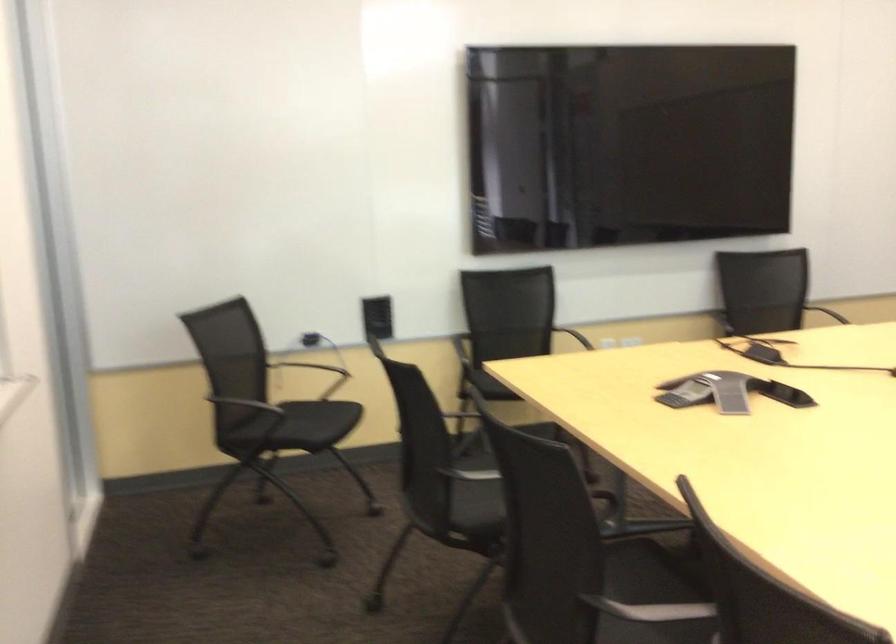
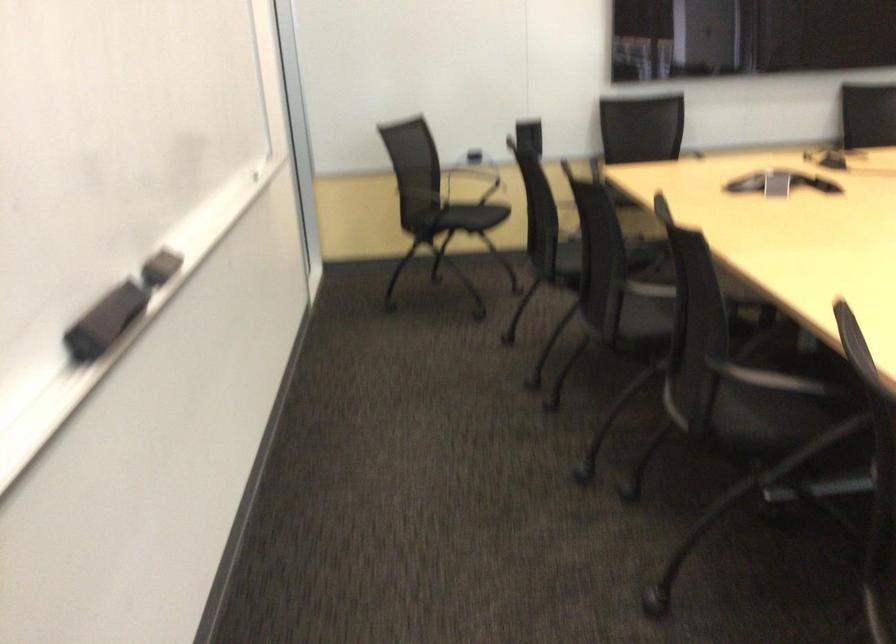
The point at (459, 500) is marked in the first image. Where is the corresponding point in the second image?

(574, 258)